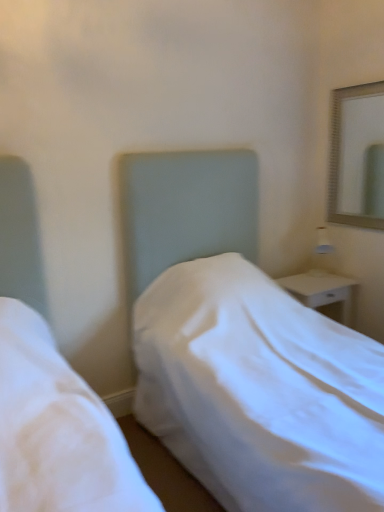
Question: Can you see white fabric bed at center touching white glossy nightstand at right?

Choices:
 (A) no
 (B) yes

Answer: (A)

Question: From the image's perspective, does white fabric bed at center appear lower than white glossy nightstand at right?

Choices:
 (A) no
 (B) yes

Answer: (A)

Question: Would you consider white fabric bed at center to be distant from white glossy nightstand at right?

Choices:
 (A) yes
 (B) no

Answer: (B)

Question: Does white fabric bed at center contain white glossy nightstand at right?

Choices:
 (A) no
 (B) yes

Answer: (B)

Question: Is white fabric bed at center bigger than white glossy nightstand at right?

Choices:
 (A) yes
 (B) no

Answer: (A)

Question: Is white fabric bed at center positioned behind white glossy nightstand at right?

Choices:
 (A) no
 (B) yes

Answer: (A)

Question: Is white fabric bed at center further to the viewer compared to silver metallic mirror at upper right?

Choices:
 (A) no
 (B) yes

Answer: (A)

Question: Does white fabric bed at center have a greater height compared to silver metallic mirror at upper right?

Choices:
 (A) no
 (B) yes

Answer: (B)

Question: Can you confirm if white fabric bed at center is wider than silver metallic mirror at upper right?

Choices:
 (A) no
 (B) yes

Answer: (B)

Question: Could you tell me if white fabric bed at center is facing silver metallic mirror at upper right?

Choices:
 (A) no
 (B) yes

Answer: (A)

Question: Does white fabric bed at center appear on the right side of silver metallic mirror at upper right?

Choices:
 (A) yes
 (B) no

Answer: (B)

Question: From a real-world perspective, does white fabric bed at center stand above silver metallic mirror at upper right?

Choices:
 (A) no
 (B) yes

Answer: (A)

Question: Is white glossy nightstand at right oriented towards white fabric bed at center?

Choices:
 (A) no
 (B) yes

Answer: (A)